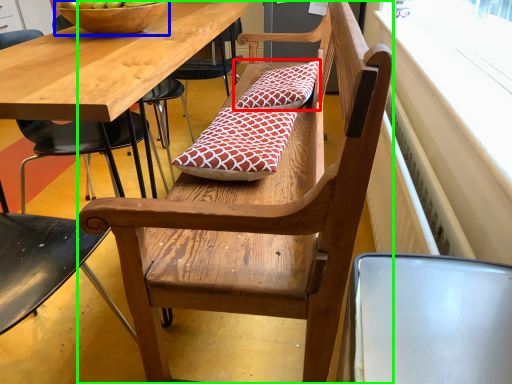
Question: Considering the real-world distances, which object is closest to pillow (highlighted by a red box)? bowl (highlighted by a blue box) or bench (highlighted by a green box).

Choices:
 (A) bowl
 (B) bench

Answer: (A)